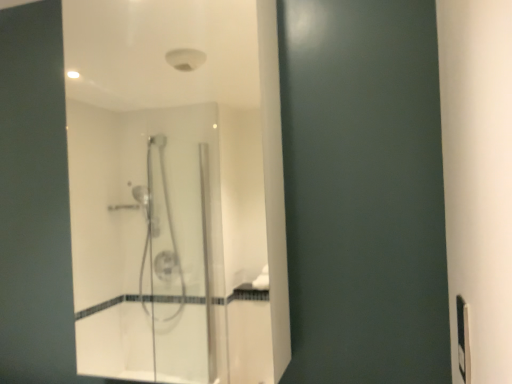
Question: Based on their sizes in the image, would you say black plastic electric outlet at right is bigger or smaller than transparent glass shower door at center?

Choices:
 (A) big
 (B) small

Answer: (B)

Question: Would you say black plastic electric outlet at right is to the left or to the right of transparent glass shower door at center in the picture?

Choices:
 (A) left
 (B) right

Answer: (B)

Question: Would you say black plastic electric outlet at right is inside or outside transparent glass shower door at center?

Choices:
 (A) inside
 (B) outside

Answer: (B)

Question: In the image, is transparent glass shower door at center positioned in front of or behind black plastic electric outlet at right?

Choices:
 (A) behind
 (B) front

Answer: (A)

Question: Considering the positions of transparent glass shower door at center and black plastic electric outlet at right in the image, is transparent glass shower door at center bigger or smaller than black plastic electric outlet at right?

Choices:
 (A) big
 (B) small

Answer: (A)

Question: Is transparent glass shower door at center inside or outside of black plastic electric outlet at right?

Choices:
 (A) inside
 (B) outside

Answer: (B)

Question: From the image's perspective, is transparent glass shower door at center positioned above or below black plastic electric outlet at right?

Choices:
 (A) above
 (B) below

Answer: (A)